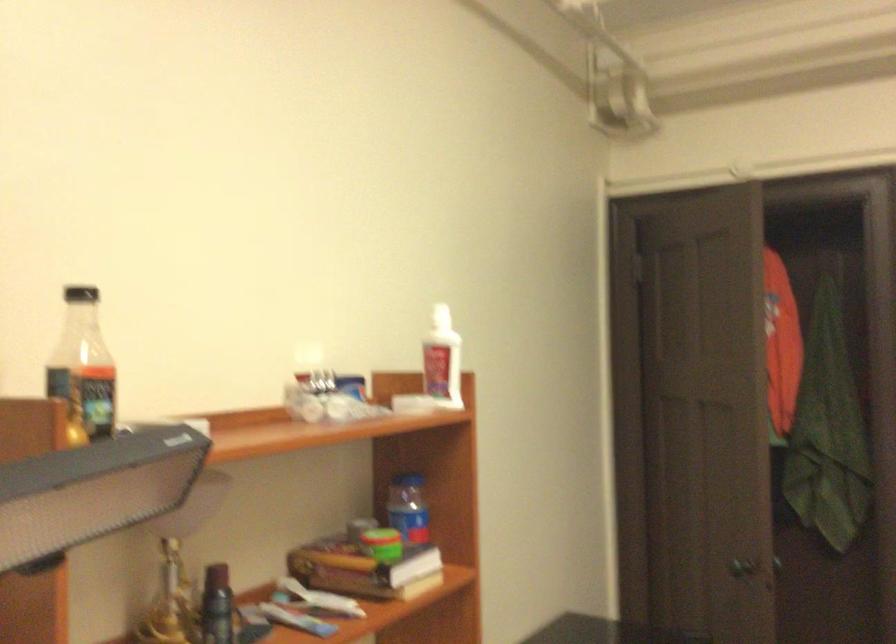
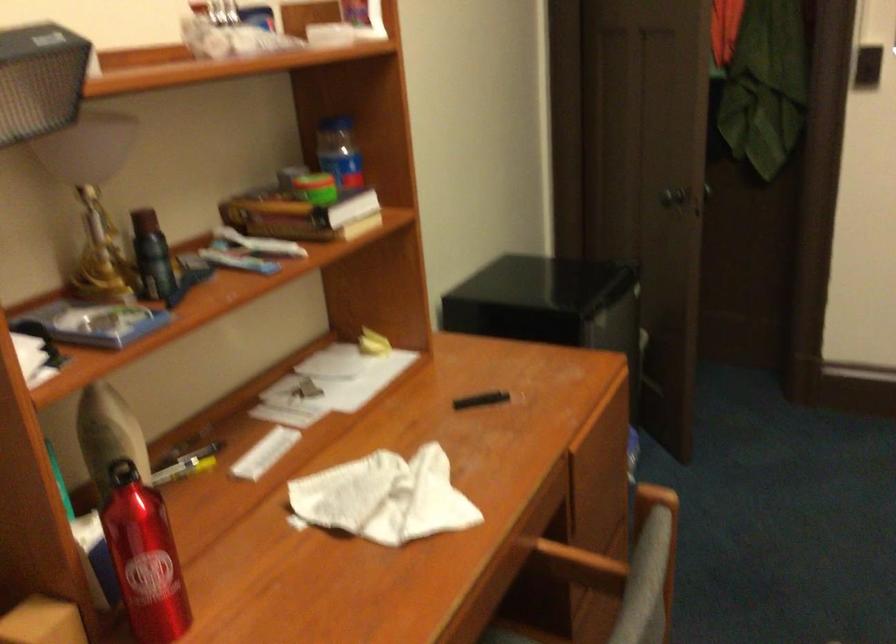
The point at (408, 504) is marked in the first image. Where is the corresponding point in the second image?

(339, 152)